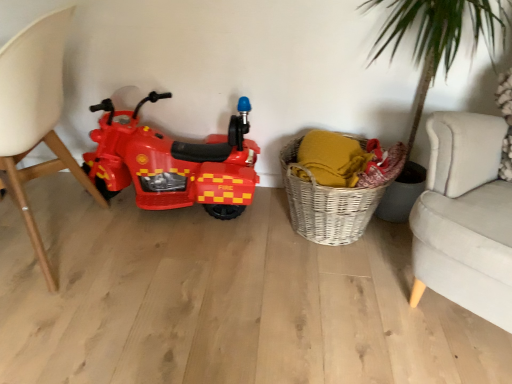
Question: Would you say shiny plastic toy motorcycle at left is inside or outside matte white chair at left?

Choices:
 (A) inside
 (B) outside

Answer: (B)

Question: Considering the positions of shiny plastic toy motorcycle at left and matte white chair at left in the image, is shiny plastic toy motorcycle at left bigger or smaller than matte white chair at left?

Choices:
 (A) small
 (B) big

Answer: (A)

Question: Based on their relative distances, which object is nearer to the shiny plastic toy motorcycle at left?

Choices:
 (A) woven wicker basket at lower right
 (B) matte white chair at left

Answer: (B)

Question: Estimate the real-world distances between objects in this image. Which object is farther from the matte white chair at left?

Choices:
 (A) shiny plastic toy motorcycle at left
 (B) woven wicker basket at lower right

Answer: (B)